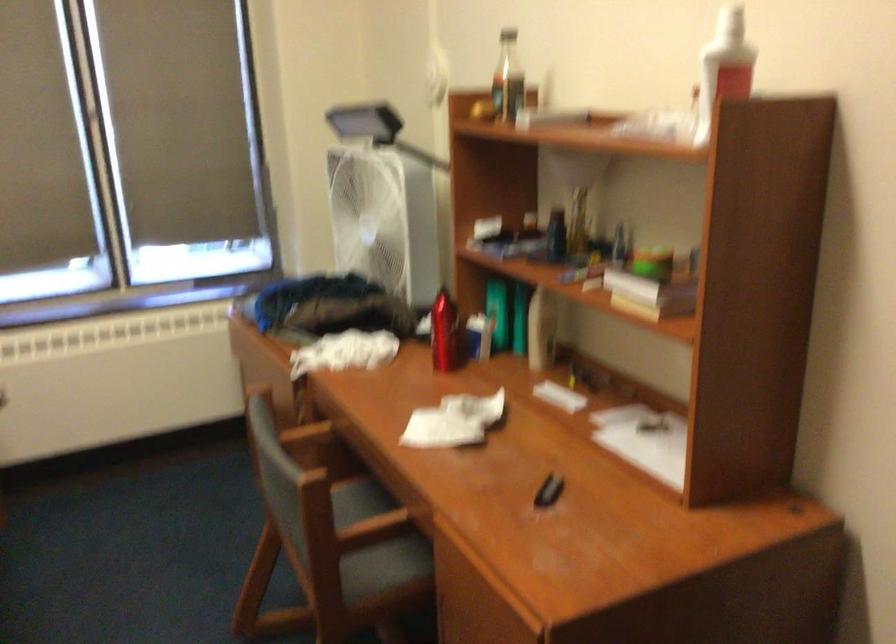
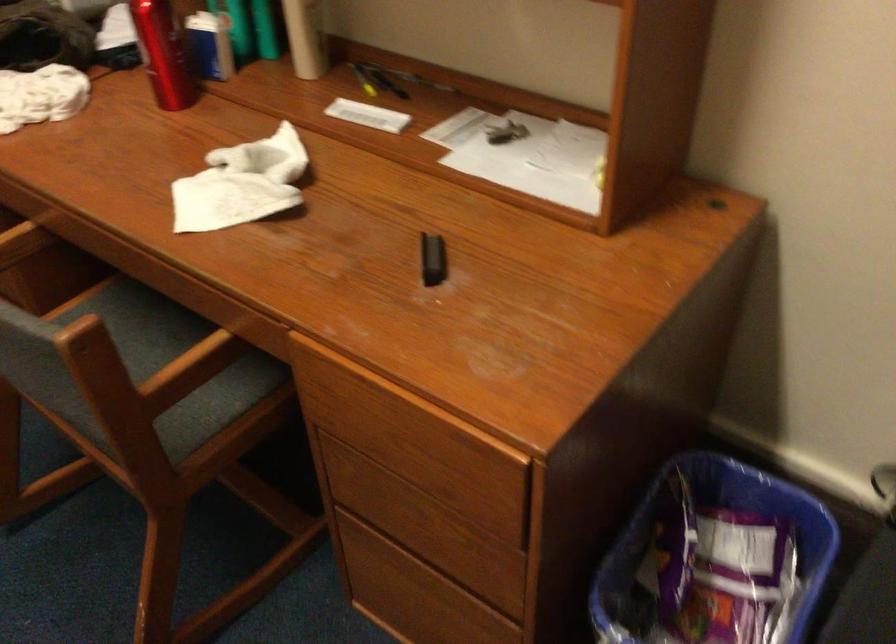
Find the pixel in the second image that matches (583,377) in the first image.

(376, 80)